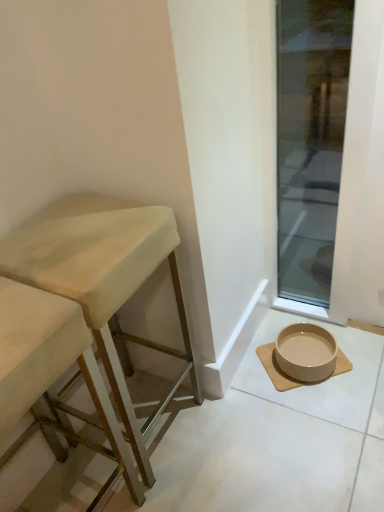
The image size is (384, 512). What do you see at coordinates (276, 439) in the screenshot? I see `beige ceramic bowl at lower right` at bounding box center [276, 439].

Find the location of a particular element. wooden stool at left, which is the first stool in left-to-right order is located at coordinates (52, 366).

Identify the location of beige ceramic bowl at lower right. This screenshot has width=384, height=512. (276, 439).

Based on their positions, is beige fabric stool at left, the 2th stool positioned from the left, located to the left or right of wooden stool at left, which is the first stool in left-to-right order?

In the image, beige fabric stool at left, the 2th stool positioned from the left, appears on the right side of wooden stool at left, which is the first stool in left-to-right order.

Measure the distance from beige fabric stool at left, the 2th stool positioned from the left, to wooden stool at left, marked as the second stool in a right-to-left arrangement.

beige fabric stool at left, the 2th stool positioned from the left, and wooden stool at left, marked as the second stool in a right-to-left arrangement, are 6.26 inches apart.

Is beige fabric stool at left, the 2th stool positioned from the left, completely or partially outside of wooden stool at left, marked as the second stool in a right-to-left arrangement?

beige fabric stool at left, the 2th stool positioned from the left, lies outside wooden stool at left, marked as the second stool in a right-to-left arrangement,'s area.

Which of these two, beige fabric stool at left, the 2th stool positioned from the left, or wooden stool at left, which is the first stool in left-to-right order, stands taller?

beige fabric stool at left, the 2th stool positioned from the left, is taller.

Does beige fabric stool at left, the 2th stool positioned from the left, have a lesser width compared to beige ceramic bowl at lower right?

Yes.

Considering the sizes of beige fabric stool at left, the 1th stool in the right-to-left sequence, and beige ceramic bowl at lower right in the image, is beige fabric stool at left, the 1th stool in the right-to-left sequence, taller or shorter than beige ceramic bowl at lower right?

In the image, beige fabric stool at left, the 1th stool in the right-to-left sequence, appears to be taller than beige ceramic bowl at lower right.

Is beige fabric stool at left, the 1th stool in the right-to-left sequence, bigger or smaller than beige ceramic bowl at lower right?

Clearly, beige fabric stool at left, the 1th stool in the right-to-left sequence, is smaller in size than beige ceramic bowl at lower right.

The width and height of the screenshot is (384, 512). Identify the location of stool that is the 2nd object above the beige ceramic bowl at lower right (from a real-world perspective). (104, 282).

Does transparent glass door at lower right turn towards beige fabric stool at left, the 1th stool in the right-to-left sequence?

No, transparent glass door at lower right is not turned towards beige fabric stool at left, the 1th stool in the right-to-left sequence.

Between transparent glass door at lower right and beige fabric stool at left, the 2th stool positioned from the left, which one is positioned behind?

transparent glass door at lower right.

Can you confirm if transparent glass door at lower right is wider than beige fabric stool at left, the 2th stool positioned from the left?

Incorrect, the width of transparent glass door at lower right does not surpass that of beige fabric stool at left, the 2th stool positioned from the left.

From a real-world perspective, who is located higher, transparent glass door at lower right or beige fabric stool at left, the 2th stool positioned from the left?

transparent glass door at lower right, from a real-world perspective.

Does wooden stool at left, which is the first stool in left-to-right order, appear on the right side of beige fabric stool at left, the 2th stool positioned from the left?

No, wooden stool at left, which is the first stool in left-to-right order, is not to the right of beige fabric stool at left, the 2th stool positioned from the left.

Which is behind, point (55, 373) or point (82, 224)?

The point (82, 224) is farther.

Based on the photo, how many degrees apart are the facing directions of wooden stool at left, marked as the second stool in a right-to-left arrangement, and beige fabric stool at left, the 2th stool positioned from the left?

0.00134 degrees.

Is wooden stool at left, marked as the second stool in a right-to-left arrangement, spatially inside beige fabric stool at left, the 2th stool positioned from the left, or outside of it?

The correct answer is: outside.

From a real-world perspective, is transparent glass door at lower right located higher than wooden stool at left, marked as the second stool in a right-to-left arrangement?

Correct, in the physical world, transparent glass door at lower right is higher than wooden stool at left, marked as the second stool in a right-to-left arrangement.

Image resolution: width=384 pixels, height=512 pixels. In order to click on window on the right of wooden stool at left, which is the first stool in left-to-right order in this screenshot , I will do `click(310, 141)`.

Is wooden stool at left, which is the first stool in left-to-right order, inside transparent glass door at lower right?

No, wooden stool at left, which is the first stool in left-to-right order, is not a part of transparent glass door at lower right.

Is transparent glass door at lower right positioned with its back to wooden stool at left, which is the first stool in left-to-right order?

No, wooden stool at left, which is the first stool in left-to-right order, is not at the back of transparent glass door at lower right.

Starting from the transparent glass door at lower right, which stool is the 1st one to the left? Please provide its 2D coordinates.

[(104, 282)]

Is beige fabric stool at left, the 2th stool positioned from the left, facing towards transparent glass door at lower right?

No, beige fabric stool at left, the 2th stool positioned from the left, is not turned towards transparent glass door at lower right.

Is beige fabric stool at left, the 2th stool positioned from the left, thinner than transparent glass door at lower right?

No.

In the scene shown: How distant is beige ceramic bowl at lower right from transparent glass door at lower right?

beige ceramic bowl at lower right is 1.57 meters from transparent glass door at lower right.

Does point (306, 374) come closer to viewer compared to point (288, 70)?

Yes.

From the picture: Is beige ceramic bowl at lower right facing away from transparent glass door at lower right?

That's right, beige ceramic bowl at lower right is facing away from transparent glass door at lower right.

Can you tell me how much beige ceramic bowl at lower right and transparent glass door at lower right differ in facing direction?

They differ by 2.29 degrees in their facing directions.

The height and width of the screenshot is (512, 384). Identify the location of stool that is on the right side of wooden stool at left, which is the first stool in left-to-right order. (104, 282).

Image resolution: width=384 pixels, height=512 pixels. I want to click on the 2nd stool positioned above the beige ceramic bowl at lower right (from the image's perspective), so click(104, 282).

Based on their spatial positions, is beige ceramic bowl at lower right or beige fabric stool at left, the 1th stool in the right-to-left sequence, closer to wooden stool at left, which is the first stool in left-to-right order?

The object closer to wooden stool at left, which is the first stool in left-to-right order, is beige fabric stool at left, the 1th stool in the right-to-left sequence.

When comparing their distances from beige fabric stool at left, the 1th stool in the right-to-left sequence, does transparent glass door at lower right or beige ceramic bowl at lower right seem closer?

beige ceramic bowl at lower right is positioned closer to the anchor beige fabric stool at left, the 1th stool in the right-to-left sequence.

Which object lies further to the anchor point beige ceramic bowl at lower right, beige fabric stool at left, the 1th stool in the right-to-left sequence, or wooden stool at left, marked as the second stool in a right-to-left arrangement?

Among the two, wooden stool at left, marked as the second stool in a right-to-left arrangement, is located further to beige ceramic bowl at lower right.

Estimate the real-world distances between objects in this image. Which object is further from beige ceramic bowl at lower right, beige ceramic bowl at lower right or beige fabric stool at left, the 2th stool positioned from the left?

Based on the image, beige fabric stool at left, the 2th stool positioned from the left, appears to be further to beige ceramic bowl at lower right.

Considering their positions, is wooden stool at left, marked as the second stool in a right-to-left arrangement, positioned further to beige ceramic bowl at lower right than transparent glass door at lower right?

Based on the image, transparent glass door at lower right appears to be further to beige ceramic bowl at lower right.

From the image, which object appears to be nearer to transparent glass door at lower right, wooden stool at left, which is the first stool in left-to-right order, or beige ceramic bowl at lower right?

Based on the image, beige ceramic bowl at lower right appears to be nearer to transparent glass door at lower right.

Which object lies nearer to the anchor point beige ceramic bowl at lower right, beige ceramic bowl at lower right or transparent glass door at lower right?

The object closer to beige ceramic bowl at lower right is beige ceramic bowl at lower right.

Based on their spatial positions, is beige fabric stool at left, the 1th stool in the right-to-left sequence, or beige ceramic bowl at lower right closer to wooden stool at left, marked as the second stool in a right-to-left arrangement?

beige fabric stool at left, the 1th stool in the right-to-left sequence, is closer to wooden stool at left, marked as the second stool in a right-to-left arrangement.

Identify the location of stool between beige ceramic bowl at lower right and beige ceramic bowl at lower right from front to back. This screenshot has height=512, width=384. (104, 282).

The height and width of the screenshot is (512, 384). I want to click on bowl between beige fabric stool at left, the 2th stool positioned from the left, and transparent glass door at lower right, in the horizontal direction, so click(x=306, y=352).

Identify the location of concrete situated between wooden stool at left, which is the first stool in left-to-right order, and transparent glass door at lower right from left to right. (276, 439).

At what (x,y) coordinates should I click in order to perform the action: click on stool situated between wooden stool at left, marked as the second stool in a right-to-left arrangement, and transparent glass door at lower right from left to right. Please return your answer as a coordinate pair (x, y). Looking at the image, I should click on (104, 282).